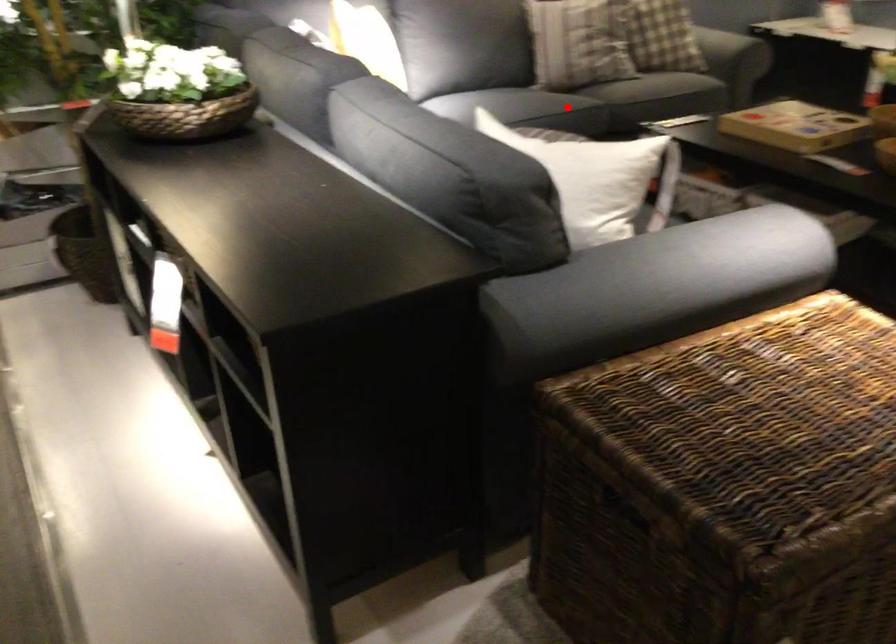
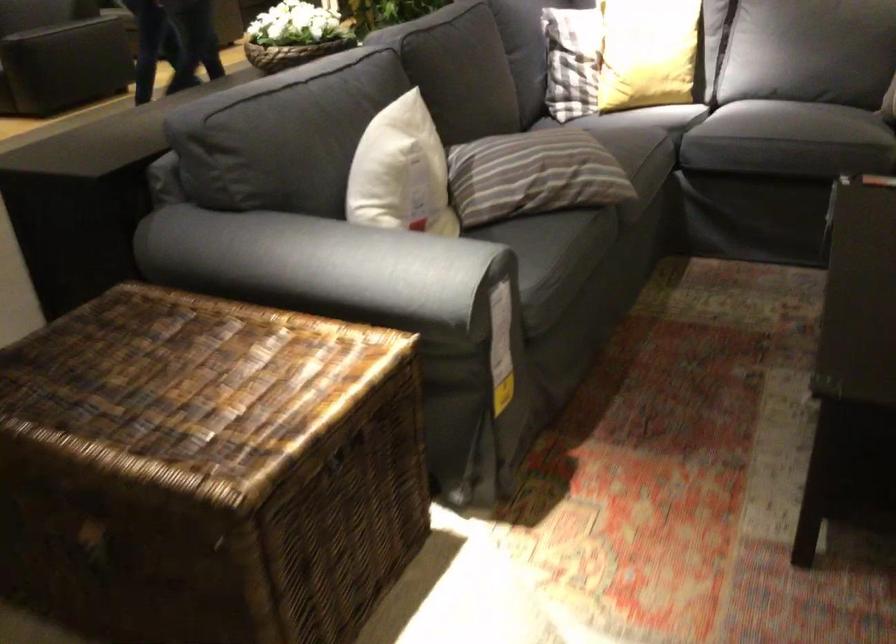
Find the pixel in the second image that matches the highlighted location in the first image.

(768, 122)